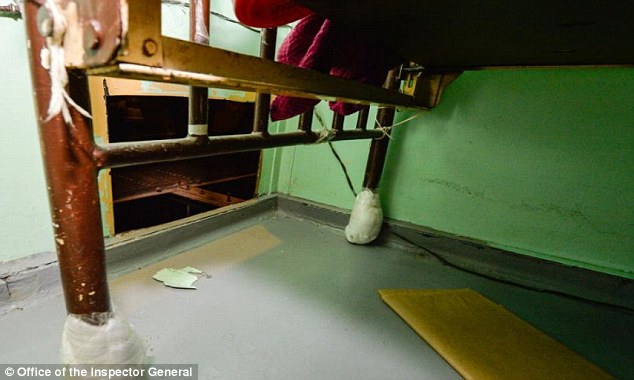
Locate an element on the screen. The width and height of the screenshot is (634, 380). blanket is located at coordinates (297, 242), (335, 52).